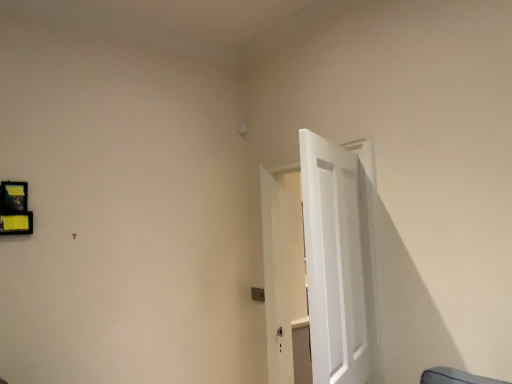
Describe the element at coordinates (324, 262) in the screenshot. The image size is (512, 384). I see `white matte door at right` at that location.

Locate an element on the screen. The width and height of the screenshot is (512, 384). white matte door at right is located at coordinates point(324,262).

The width and height of the screenshot is (512, 384). I want to click on white matte door at right, so click(x=324, y=262).